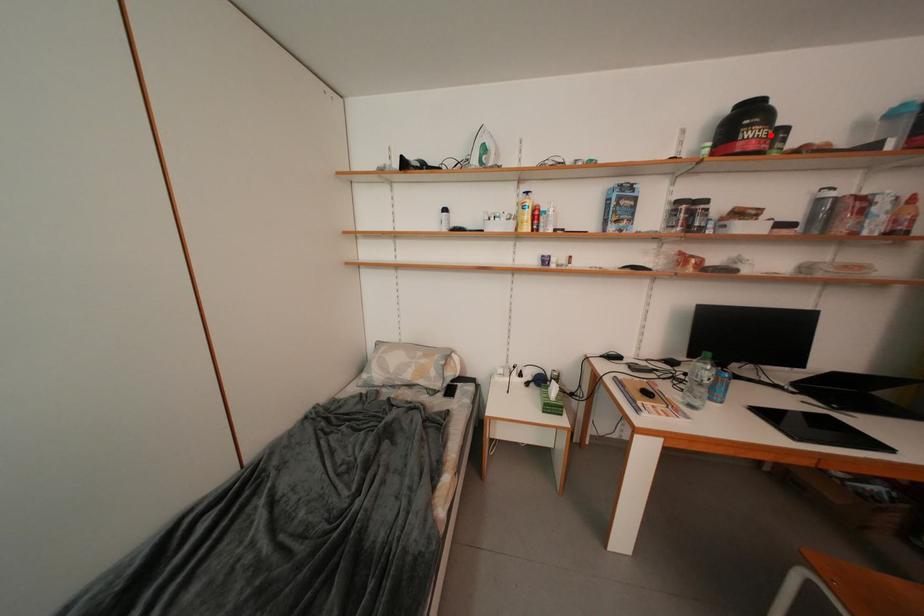
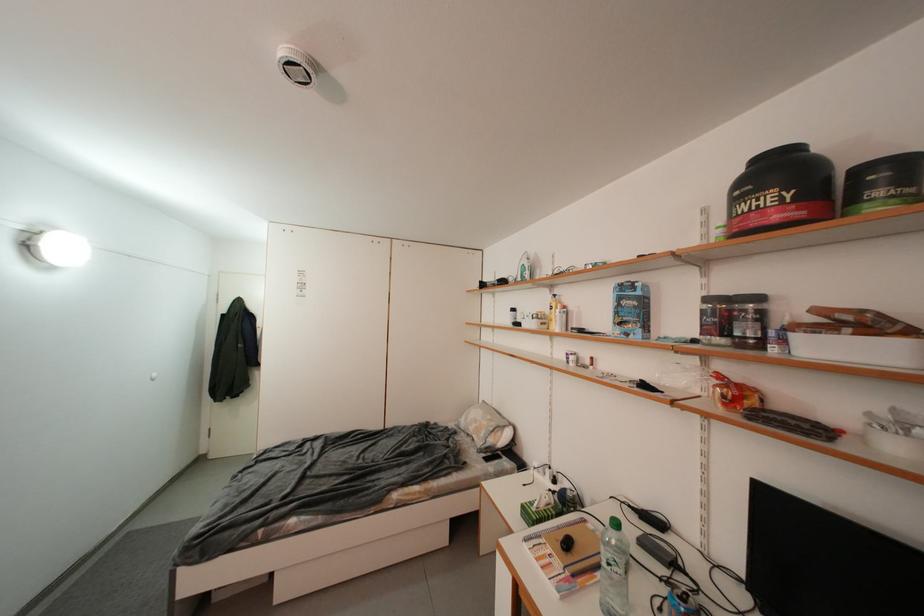
Find the pixel in the second image that matches the highlighted location in the first image.

(776, 201)